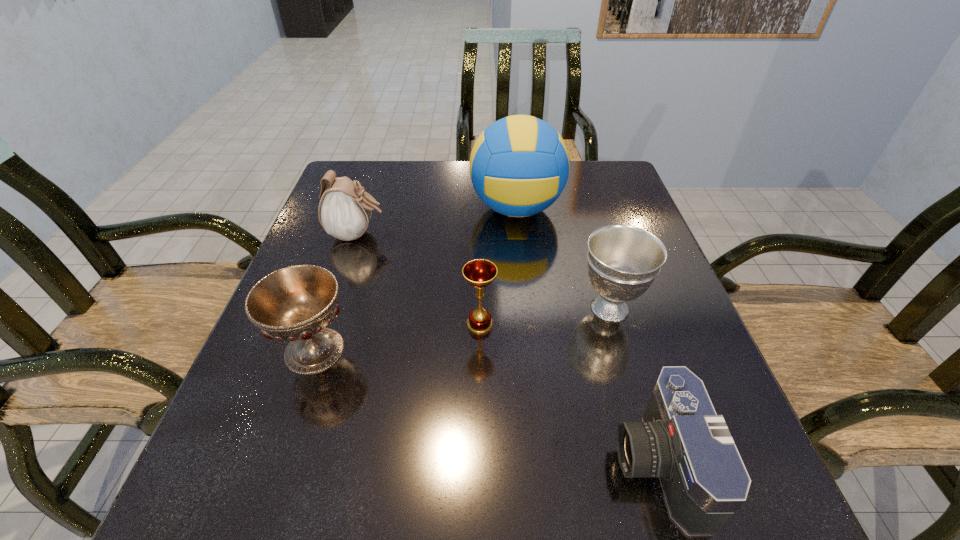
At what (x,y) coordinates should I click in order to perform the action: click on volleyball. Please return your answer as a coordinate pair (x, y). Looking at the image, I should click on (519, 165).

Identify the location of pouch. (344, 211).

Image resolution: width=960 pixels, height=540 pixels. I want to click on the rightmost chalice, so click(x=623, y=261).

This screenshot has height=540, width=960. Find the location of `the leftmost chalice`. the leftmost chalice is located at coordinates tap(296, 303).

This screenshot has width=960, height=540. In order to click on the second chalice from right to left in this screenshot , I will do `click(479, 273)`.

This screenshot has height=540, width=960. In order to click on the nearest object in this screenshot , I will do `click(682, 440)`.

Find the location of `camera`. camera is located at coordinates (682, 440).

I want to click on vacant region located 0.170m on the front of the volleyball, so click(x=524, y=285).

Identify the location of vacant space located 0.360m on the front-facing side of the pouch. Image resolution: width=960 pixels, height=540 pixels. (534, 234).

Find the location of a particular element. Image resolution: width=960 pixels, height=540 pixels. vacant space located 0.110m on the back of the rightmost chalice is located at coordinates (593, 252).